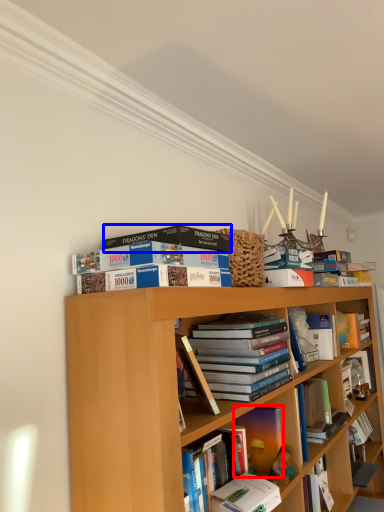
Question: Which point is further to the camera, book (highlighted by a red box) or book (highlighted by a blue box)?

Choices:
 (A) book
 (B) book

Answer: (A)